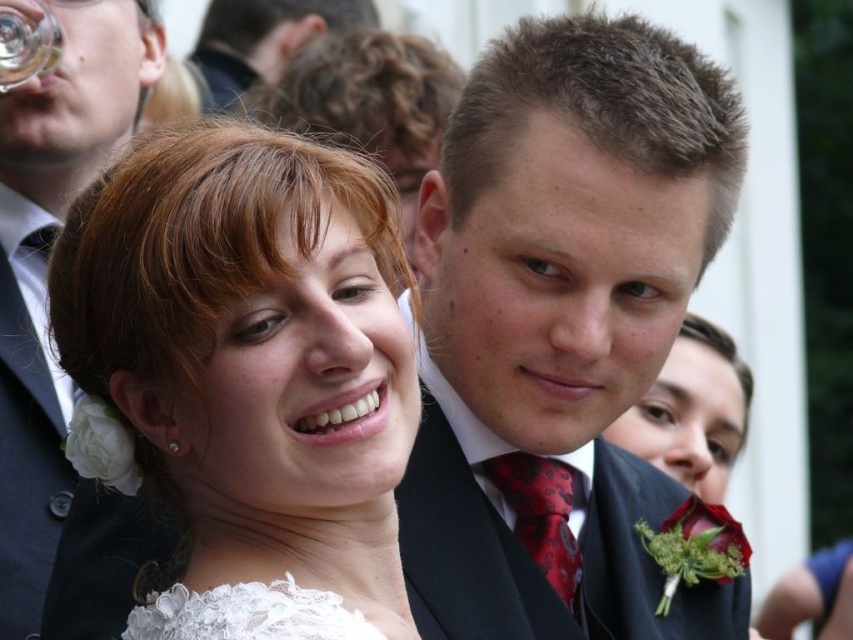
Question: Considering the relative positions of white lace dress at center and red satin tie at center in the image provided, where is white lace dress at center located with respect to red satin tie at center?

Choices:
 (A) above
 (B) below

Answer: (A)

Question: From the image, what is the correct spatial relationship of matte black hair at upper center in relation to transparent glass at upper left?

Choices:
 (A) above
 (B) below

Answer: (A)

Question: Which object appears farthest from the camera in this image?

Choices:
 (A) red satin tie at center
 (B) matte black hair at upper center
 (C) matte black suit at center

Answer: (B)

Question: Can you confirm if matte black suit at upper left is wider than matte black hair at upper center?

Choices:
 (A) no
 (B) yes

Answer: (A)

Question: Which point is closer to the camera?

Choices:
 (A) (236, 371)
 (B) (258, 72)

Answer: (A)

Question: Which of the following is the closest to the observer?

Choices:
 (A) white lace dress at center
 (B) matte black suit at upper left
 (C) matte black hair at upper center
 (D) red satin tie at center

Answer: (A)